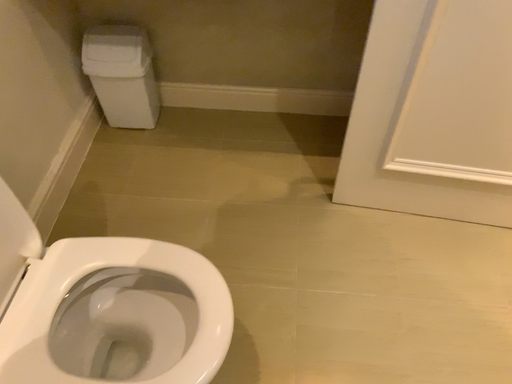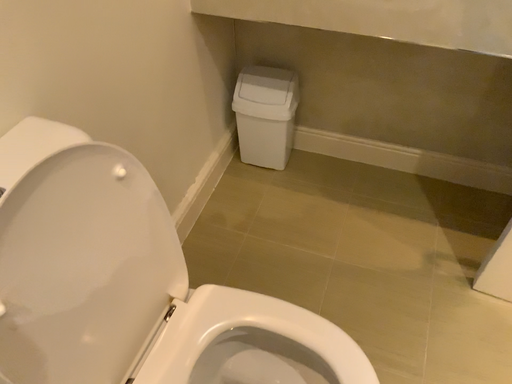
Question: Which way did the camera rotate in the video?

Choices:
 (A) rotated left
 (B) rotated right

Answer: (A)